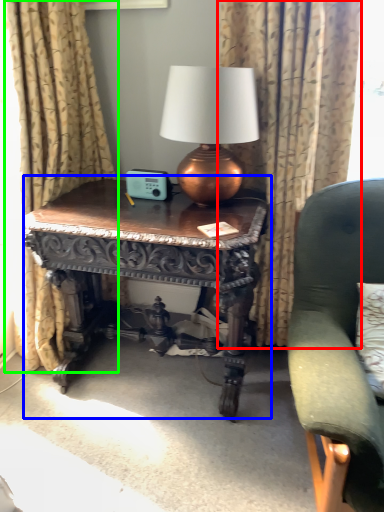
Question: Based on their relative distances, which object is farther from curtain (highlighted by a red box)? Choose from table (highlighted by a blue box) and curtain (highlighted by a green box).

Choices:
 (A) table
 (B) curtain

Answer: (B)